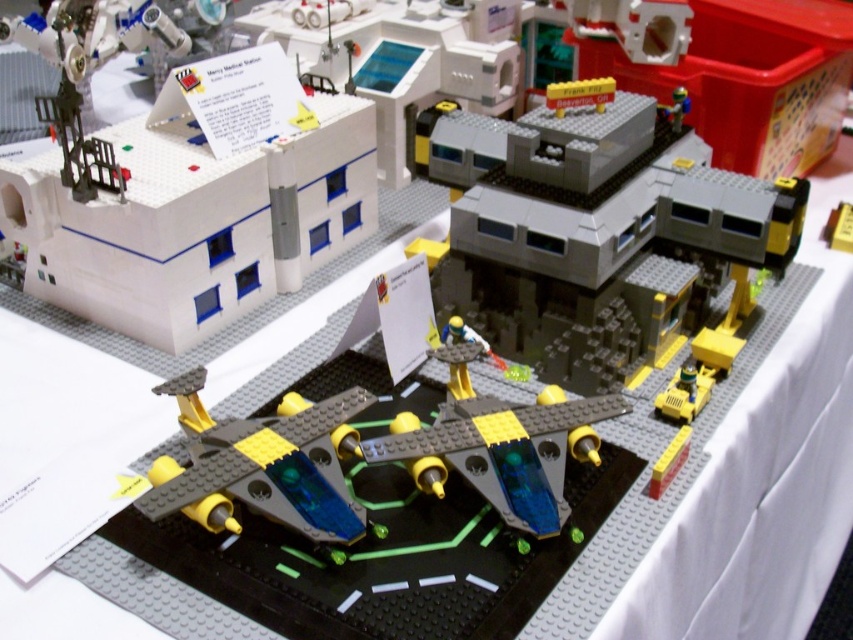
Question: Is white plastic building at upper left above translucent blue plastic spaceship at center?

Choices:
 (A) yes
 (B) no

Answer: (A)

Question: Which point appears closest to the camera in this image?

Choices:
 (A) (599, 90)
 (B) (685, 113)
 (C) (169, 493)

Answer: (C)

Question: Can you confirm if translucent blue plastic spaceship at center is wider than metallic silver robot at upper right?

Choices:
 (A) yes
 (B) no

Answer: (A)

Question: Is white plastic building at upper left further to the viewer compared to translucent blue plastic spaceship at center?

Choices:
 (A) yes
 (B) no

Answer: (A)

Question: Based on their relative distances, which object is nearer to the gray plastic building at center?

Choices:
 (A) white plastic building at upper left
 (B) translucent blue plastic spaceship at center

Answer: (A)

Question: Estimate the real-world distances between objects in this image. Which object is farther from the gray plastic building at center?

Choices:
 (A) translucent blue plastic spaceship at center
 (B) white plastic building at upper left
 (C) metallic silver robot at upper right

Answer: (A)